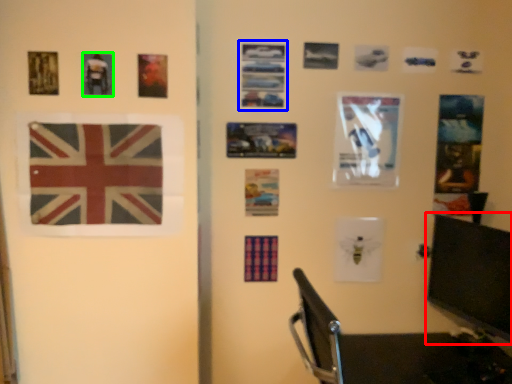
Question: Which is nearer to the computer monitor (highlighted by a red box)? postcard (highlighted by a blue box) or picture frame (highlighted by a green box).

Choices:
 (A) postcard
 (B) picture frame

Answer: (A)